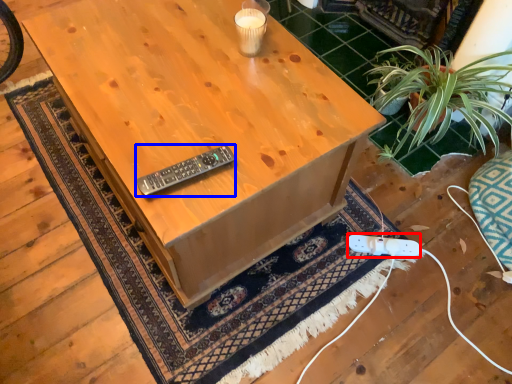
Question: Which of the following is the closest to the observer, plug (highlighted by a red box) or control (highlighted by a blue box)?

Choices:
 (A) plug
 (B) control

Answer: (B)